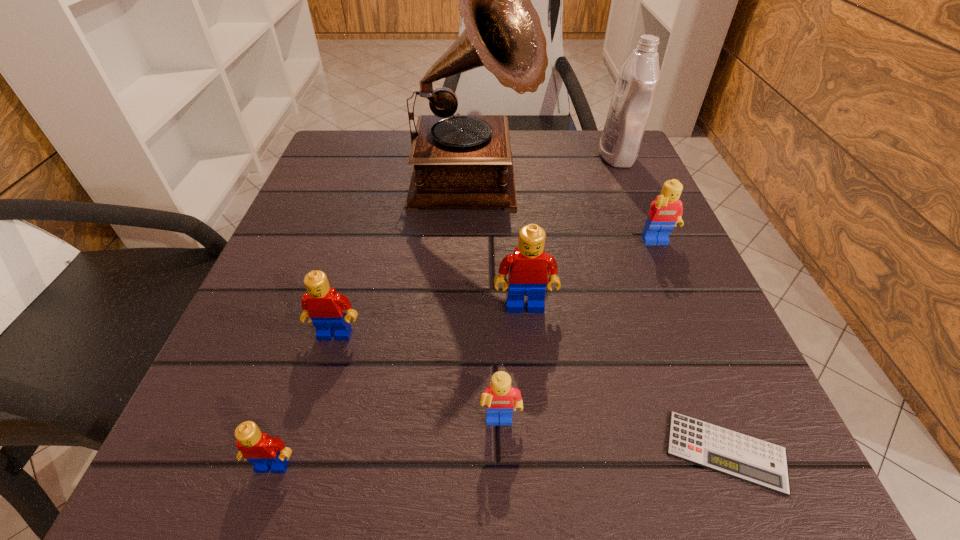
Where is `brown record player`? The height and width of the screenshot is (540, 960). brown record player is located at coordinates (459, 161).

Identify the location of record player. (459, 161).

Identify the location of the seventh shortest object. (635, 90).

Where is `white detergent`? The height and width of the screenshot is (540, 960). white detergent is located at coordinates (635, 90).

Where is `the farthest red Lego`? This screenshot has height=540, width=960. the farthest red Lego is located at coordinates (527, 267).

Identify the location of the third tallest object. The image size is (960, 540). (527, 267).

Find the location of `the sixth nearest object`. the sixth nearest object is located at coordinates (665, 212).

You are a GUI agent. You are given a task and a screenshot of the screen. Output one action in this format:
    pyautogui.click(x=<x>, y=<y>)
    Task: Click on the bigger yellow Lego
    Image resolution: width=960 pixels, height=540 pixels.
    Given the screenshot: What is the action you would take?
    pyautogui.click(x=665, y=212)

Locate an element on the screen. Image resolution: width=960 pixels, height=540 pixels. the second nearest red Lego is located at coordinates (323, 306).

Identify the location of the second smallest red Lego. (323, 306).